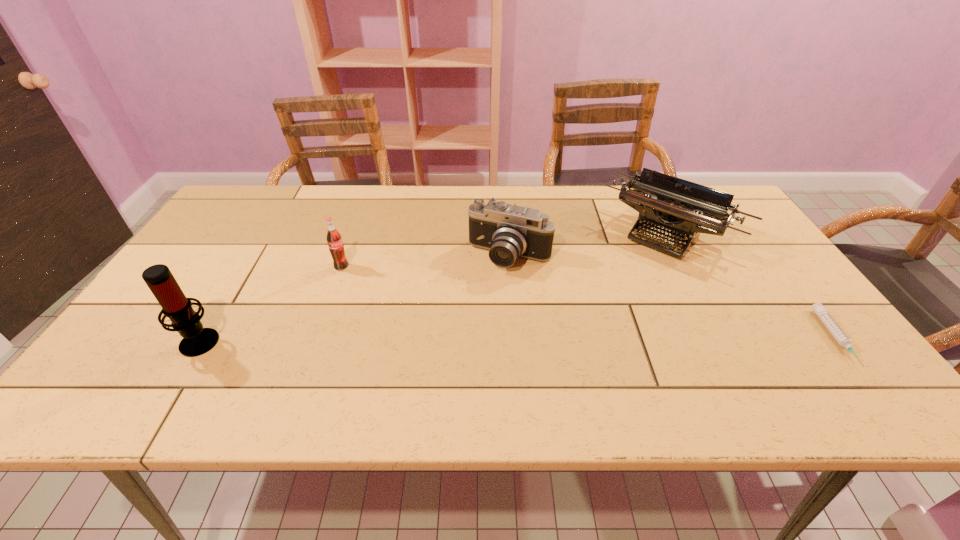
Identify the location of vacant space at the far left corner of the desktop. The height and width of the screenshot is (540, 960). (257, 188).

This screenshot has height=540, width=960. I want to click on vacant point located between the typewriter and the leftmost object, so click(x=435, y=285).

Find the location of a particular element. The image size is (960, 540). vacant space in between the second object from left to right and the rightmost object is located at coordinates (588, 302).

At what (x,y) coordinates should I click in order to perform the action: click on vacant area that lies between the second object from right to left and the syringe. Please return your answer as a coordinate pair (x, y). Looking at the image, I should click on (753, 285).

At what (x,y) coordinates should I click in order to perform the action: click on vacant space in between the shortest object and the third object from right to left. Please return your answer as a coordinate pair (x, y). Image resolution: width=960 pixels, height=540 pixels. Looking at the image, I should click on (673, 298).

Image resolution: width=960 pixels, height=540 pixels. I want to click on free space between the camera and the soda bottle, so click(425, 262).

You are a GUI agent. You are given a task and a screenshot of the screen. Output one action in this format:
    pyautogui.click(x=<x>, y=<y>)
    Task: Click on the vacant space in between the third object from left to right and the tallest object
    This screenshot has width=960, height=540.
    Given the screenshot: What is the action you would take?
    pyautogui.click(x=355, y=299)

Where is `vacant space that's between the camera and the tallest object`? vacant space that's between the camera and the tallest object is located at coordinates (355, 299).

This screenshot has height=540, width=960. In order to click on vacant space that is in between the fourth object from right to left and the rightmost object in this screenshot , I will do `click(588, 302)`.

The width and height of the screenshot is (960, 540). Identify the location of free spot between the rightmost object and the third object from left to right. (673, 298).